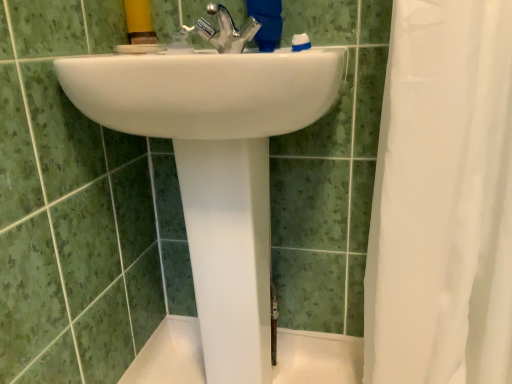
Measure the distance between polished chrome faucet at center and camera.

They are 35.33 inches apart.

This screenshot has width=512, height=384. I want to click on white glossy sink at center, so click(x=217, y=168).

How different are the orientations of white sheer fabric at right and polished chrome faucet at center in degrees?

The facing directions of white sheer fabric at right and polished chrome faucet at center are 5.01 degrees apart.

Is point (394, 209) positioned before point (217, 19)?

Yes, it is in front of point (217, 19).

From a real-world perspective, is white sheer fabric at right under polished chrome faucet at center?

Yes, from a real-world perspective, white sheer fabric at right is under polished chrome faucet at center.

Considering the sizes of objects white sheer fabric at right and polished chrome faucet at center in the image provided, who is thinner, white sheer fabric at right or polished chrome faucet at center?

Thinner between the two is polished chrome faucet at center.

Does polished chrome faucet at center come in front of white sheer fabric at right?

No, it is behind white sheer fabric at right.

Consider the image. Is polished chrome faucet at center beside white sheer fabric at right?

No, polished chrome faucet at center is not with white sheer fabric at right.

From the image's perspective, is polished chrome faucet at center located beneath white sheer fabric at right?

No, from the image's perspective, polished chrome faucet at center is not beneath white sheer fabric at right.

Is white sheer fabric at right directly adjacent to white glossy sink at center?

No, white sheer fabric at right is not beside white glossy sink at center.

From the picture: Considering their positions, is white sheer fabric at right located in front of or behind white glossy sink at center?

white sheer fabric at right is positioned closer to the viewer than white glossy sink at center.

Find the location of a particular element. Image resolution: width=512 pixels, height=384 pixels. shower curtain located on the right of white glossy sink at center is located at coordinates (443, 199).

In the scene shown: Between white sheer fabric at right and white glossy sink at center, which one has smaller size?

With smaller size is white sheer fabric at right.

Is white glossy sink at center oriented away from polished chrome faucet at center?

No, white glossy sink at center is not facing away from polished chrome faucet at center.

Considering the sizes of white glossy sink at center and polished chrome faucet at center in the image, is white glossy sink at center wider or thinner than polished chrome faucet at center?

Considering their sizes, white glossy sink at center looks broader than polished chrome faucet at center.

From the image's perspective, which is above, white glossy sink at center or polished chrome faucet at center?

polished chrome faucet at center appears higher in the image.

Are white glossy sink at center and polished chrome faucet at center located far from each other?

Actually, white glossy sink at center and polished chrome faucet at center are a little close together.

From the picture: Is white glossy sink at center taller than white sheer fabric at right?

No.

Is point (251, 305) positioned after point (453, 382)?

That is True.

Is white glossy sink at center situated inside white sheer fabric at right or outside?

white glossy sink at center is outside white sheer fabric at right.

Which object is thinner, white glossy sink at center or white sheer fabric at right?

Thinner between the two is white sheer fabric at right.

Are polished chrome faucet at center and white glossy sink at center far apart?

They are positioned close to each other.

Is polished chrome faucet at center thinner than white glossy sink at center?

Indeed, polished chrome faucet at center has a lesser width compared to white glossy sink at center.

From a real-world perspective, which is physically above, polished chrome faucet at center or white glossy sink at center?

polished chrome faucet at center, from a real-world perspective.

Is polished chrome faucet at center turned away from white glossy sink at center?

That's not correct — polished chrome faucet at center is not looking away from white glossy sink at center.

Locate an element on the screen. The height and width of the screenshot is (384, 512). tap lying on the left of white sheer fabric at right is located at coordinates (223, 29).

Identify the location of tap above the white sheer fabric at right (from a real-world perspective). The image size is (512, 384). (223, 29).

Consider the image. Estimate the real-world distances between objects in this image. Which object is further from white sheer fabric at right, white glossy sink at center or polished chrome faucet at center?

polished chrome faucet at center is positioned further to the anchor white sheer fabric at right.

Estimate the real-world distances between objects in this image. Which object is closer to polished chrome faucet at center, white sheer fabric at right or white glossy sink at center?

white glossy sink at center lies closer to polished chrome faucet at center than the other object.

Considering their positions, is polished chrome faucet at center positioned further to white sheer fabric at right than white glossy sink at center?

The object further to white sheer fabric at right is polished chrome faucet at center.

When comparing their distances from white glossy sink at center, does polished chrome faucet at center or white sheer fabric at right seem closer?

white sheer fabric at right is positioned closer to the anchor white glossy sink at center.

Estimate the real-world distances between objects in this image. Which object is further from white glossy sink at center, white sheer fabric at right or polished chrome faucet at center?

The object further to white glossy sink at center is polished chrome faucet at center.

Based on the photo, which object lies further to the anchor point polished chrome faucet at center, white glossy sink at center or white sheer fabric at right?

white sheer fabric at right lies further to polished chrome faucet at center than the other object.

I want to click on tap located between white glossy sink at center and white sheer fabric at right in the left-right direction, so click(223, 29).